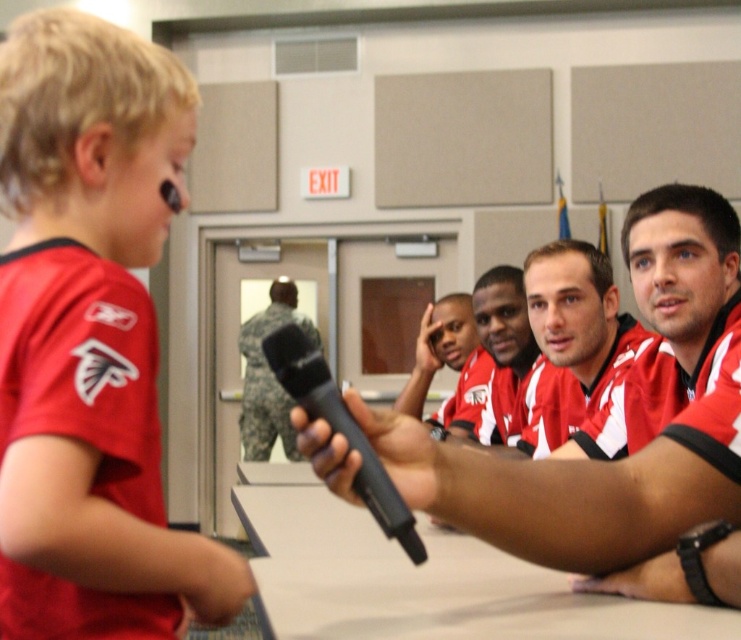
Question: Is matte red jersey at left in front of matte jersey at center?

Choices:
 (A) yes
 (B) no

Answer: (A)

Question: Considering the real-world distances, which object is farthest from the black matte microphone at upper center?

Choices:
 (A) matte red jersey at left
 (B) camouflage uniform at center

Answer: (B)

Question: From the image, what is the correct spatial relationship of matte black microphone at center in relation to red jersey at center?

Choices:
 (A) right
 (B) left

Answer: (A)

Question: Which point appears farthest from the camera in this image?

Choices:
 (A) (445, 305)
 (B) (651, 481)
 (C) (166, 202)

Answer: (A)

Question: Which point appears farthest from the camera in this image?

Choices:
 (A) (461, 296)
 (B) (256, 368)
 (C) (166, 179)
 (D) (624, 547)

Answer: (B)

Question: Can you confirm if black plastic microphone at center is smaller than black matte microphone at upper center?

Choices:
 (A) yes
 (B) no

Answer: (B)